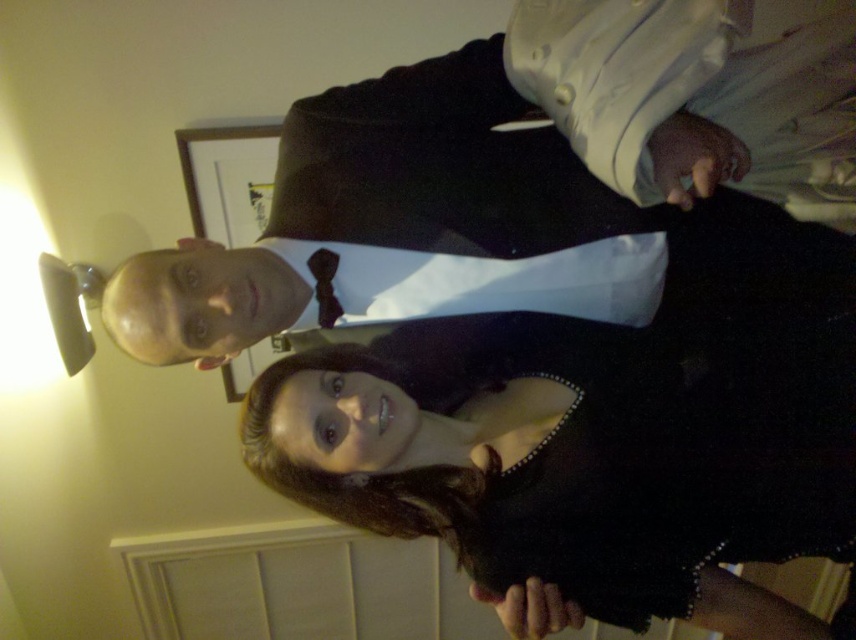
Question: Which object appears farthest from the camera in this image?

Choices:
 (A) dark brown textured bow tie at center
 (B) black satin dress at center

Answer: (A)

Question: Is black satin dress at center smaller than dark brown textured bow tie at center?

Choices:
 (A) yes
 (B) no

Answer: (B)

Question: Among these points, which one is nearest to the camera?

Choices:
 (A) (821, 157)
 (B) (324, 278)
 (C) (841, 449)

Answer: (A)

Question: Does black satin dress at center appear under dark brown textured bow tie at center?

Choices:
 (A) yes
 (B) no

Answer: (A)

Question: Considering the real-world distances, which object is closest to the black satin dress at center?

Choices:
 (A) dark brown textured bow tie at center
 (B) matte black suit at upper center

Answer: (B)

Question: Is matte black suit at upper center below black satin dress at center?

Choices:
 (A) no
 (B) yes

Answer: (A)